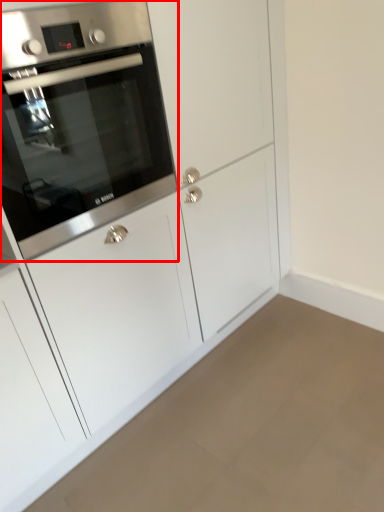
Question: Where is oven (annotated by the red box) located in relation to plain in the image?

Choices:
 (A) left
 (B) right

Answer: (A)